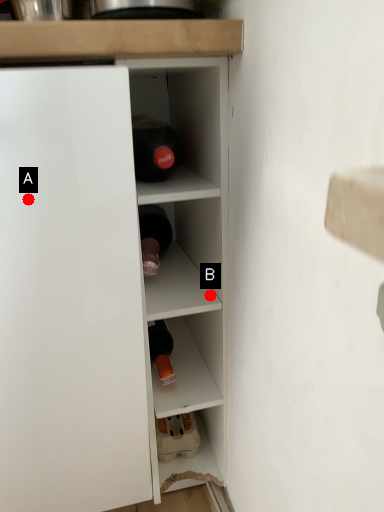
Question: Two points are circled on the image, labeled by A and B beside each circle. Which point is farther to the camera?

Choices:
 (A) A is further
 (B) B is further

Answer: (B)